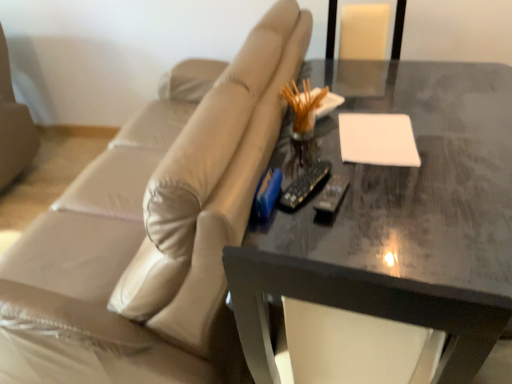
Question: Is point (160, 168) positioned closer to the camera than point (343, 283)?

Choices:
 (A) farther
 (B) closer

Answer: (A)

Question: Considering the relative positions of beige leather couch at center and shiny dark gray table at center in the image provided, is beige leather couch at center to the left or to the right of shiny dark gray table at center?

Choices:
 (A) right
 (B) left

Answer: (B)

Question: Which is farther from the black plastic remote at center?

Choices:
 (A) shiny dark gray table at center
 (B) beige leather couch at center
 (C) white matte notepad at upper right

Answer: (B)

Question: Which object is positioned farthest from the black plastic remote at center?

Choices:
 (A) beige leather couch at center
 (B) white matte notepad at upper right
 (C) shiny dark gray table at center

Answer: (A)